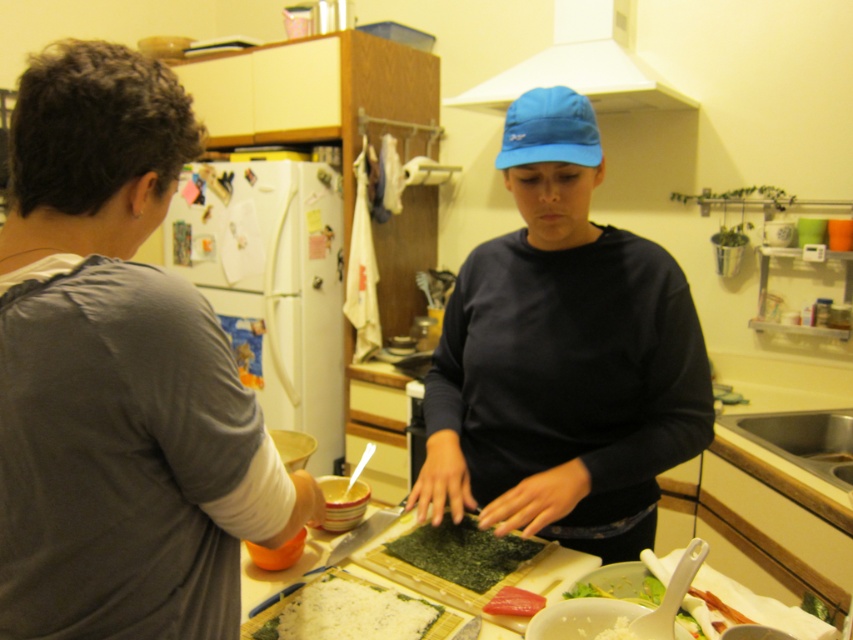
Question: Is dark blue fabric shirt at center positioned in front of white rice paper at center?

Choices:
 (A) no
 (B) yes

Answer: (A)

Question: Based on their relative distances, which object is farther from the white rice paper at center?

Choices:
 (A) white creamy salad at lower right
 (B) white matte exhaust hood at upper center
 (C) gray cotton shirt at left
 (D) dark blue fabric shirt at center

Answer: (B)

Question: Is gray cotton shirt at left wider than dark blue fabric shirt at center?

Choices:
 (A) no
 (B) yes

Answer: (A)

Question: Can you confirm if gray cotton shirt at left is thinner than white creamy salad at lower right?

Choices:
 (A) yes
 (B) no

Answer: (B)

Question: Which of the following is the farthest from the observer?

Choices:
 (A) white creamy salad at lower right
 (B) white matte exhaust hood at upper center

Answer: (B)

Question: Which object is positioned farthest from the white creamy salad at lower right?

Choices:
 (A) gray cotton shirt at left
 (B) white matte exhaust hood at upper center

Answer: (B)